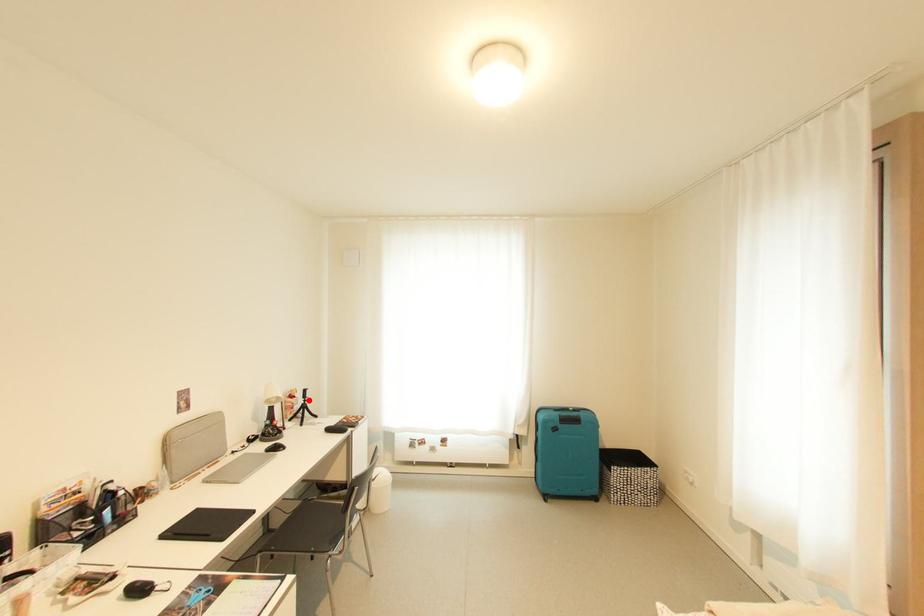
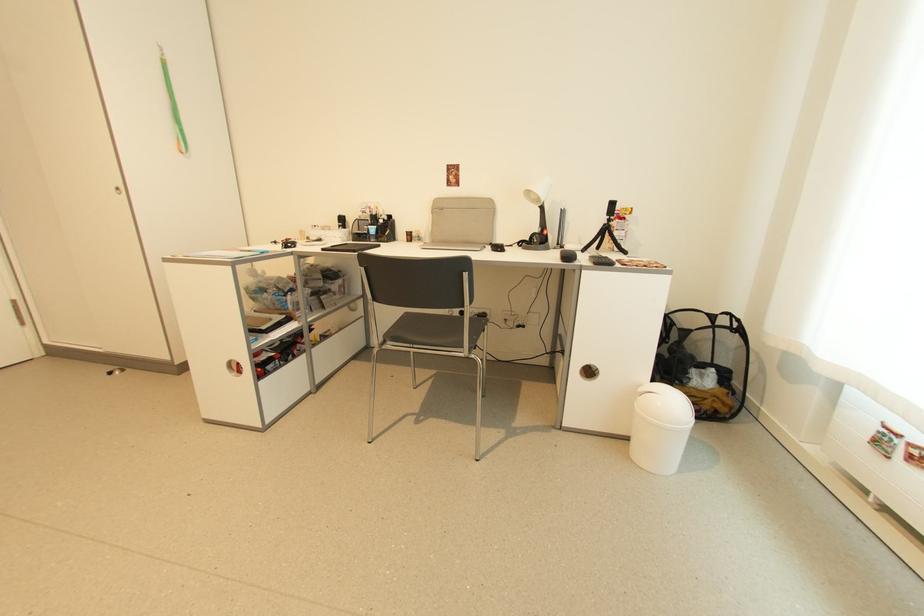
In the second image, find the point that corresponds to the highlighted location in the first image.

(612, 217)